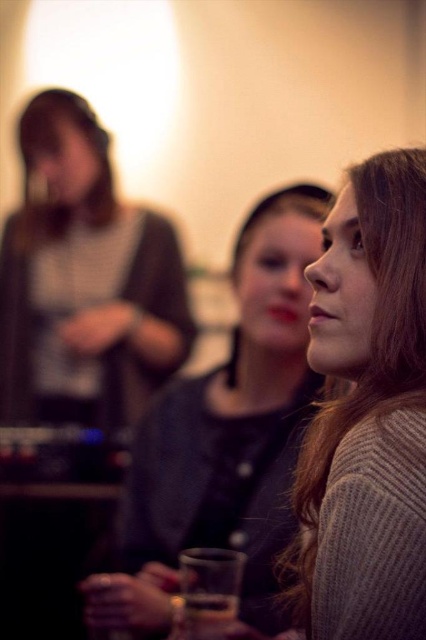
Question: Considering the real-world distances, which object is farthest from the matte black cup at lower center?

Choices:
 (A) knit sweater at center
 (B) smooth gray sweater at center

Answer: (A)

Question: Is knit sweater at center to the left of matte black cup at lower center from the viewer's perspective?

Choices:
 (A) no
 (B) yes

Answer: (A)

Question: Is knit sweater at center bigger than smooth gray sweater at center?

Choices:
 (A) yes
 (B) no

Answer: (B)

Question: Which object is farther from the camera taking this photo?

Choices:
 (A) matte black cup at lower center
 (B) knit sweater at center
 (C) smooth gray sweater at center

Answer: (C)

Question: Which of the following is the closest to the observer?

Choices:
 (A) (408, 260)
 (B) (129, 612)

Answer: (A)

Question: Does smooth gray sweater at center appear under matte black cup at lower center?

Choices:
 (A) no
 (B) yes

Answer: (A)